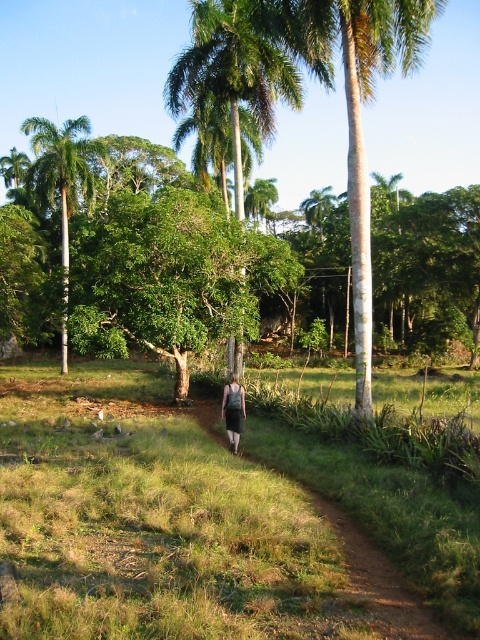
You are a hiker on the dirt path and want to take a photo of the gray fabric skirt at center without the green leafy palm tree at center blocking the view. Is this possible from your current position?

The gray fabric skirt at center is behind the green leafy palm tree at center, so it is currently blocked by the tree. To take a photo without the tree blocking, you would need to move to a position where the skirt is no longer behind the tree, such as to the side or behind the tree.

You are a hiker who wants to take a photo of both the green grass at center and the green leafy palm tree at left. The camera you have can capture objects within a 40 feet range. Will you be able to capture both in a single photo?

The green grass at center and green leafy palm tree at left are 41.41 feet apart from each other. Since the camera can only capture objects within a 40 feet range, the distance between them exceeds the camera range. Therefore, you cannot capture both in a single photo.